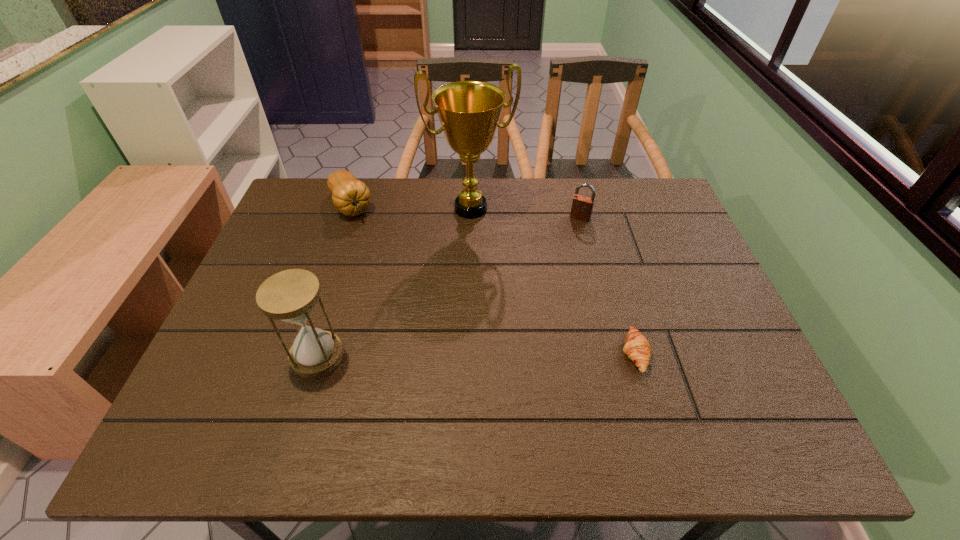
Where is `vacant space in between the pastry and the hourglass`? vacant space in between the pastry and the hourglass is located at coordinates (476, 355).

Identify the location of blank region between the hourglass and the third object from left to right. The width and height of the screenshot is (960, 540). (394, 282).

Point out which object is positioned as the second nearest to the shortest object. Please provide its 2D coordinates. Your answer should be formatted as a tuple, i.e. [(x, y)], where the tuple contains the x and y coordinates of a point satisfying the conditions above.

[(469, 111)]

Identify which object is the fourth nearest to the second tallest object. Please provide its 2D coordinates. Your answer should be formatted as a tuple, i.e. [(x, y)], where the tuple contains the x and y coordinates of a point satisfying the conditions above.

[(582, 206)]

Locate an element on the screen. The height and width of the screenshot is (540, 960). blank space that satisfies the following two spatial constraints: 1. on the front side of the pastry; 2. on the front-facing side of the third object from left to right is located at coordinates (468, 354).

Find the location of a particular element. vacant space that satisfies the following two spatial constraints: 1. on the back side of the shortest object; 2. on the front-facing side of the hourglass is located at coordinates (318, 354).

The image size is (960, 540). Find the location of `free region that satisfies the following two spatial constraints: 1. on the front side of the third object from right to left; 2. on the right side of the padlock`. free region that satisfies the following two spatial constraints: 1. on the front side of the third object from right to left; 2. on the right side of the padlock is located at coordinates (470, 218).

Locate an element on the screen. Image resolution: width=960 pixels, height=540 pixels. free region that satisfies the following two spatial constraints: 1. on the front side of the second tallest object; 2. on the right side of the gourd is located at coordinates (300, 356).

Find the location of `vacant space that satisfies the following two spatial constraints: 1. on the front side of the award; 2. on the right side of the gourd`. vacant space that satisfies the following two spatial constraints: 1. on the front side of the award; 2. on the right side of the gourd is located at coordinates (350, 208).

Image resolution: width=960 pixels, height=540 pixels. What are the coordinates of `vacant space that satisfies the following two spatial constraints: 1. on the front side of the shortest object; 2. on the front-facing side of the padlock` in the screenshot? It's located at (614, 354).